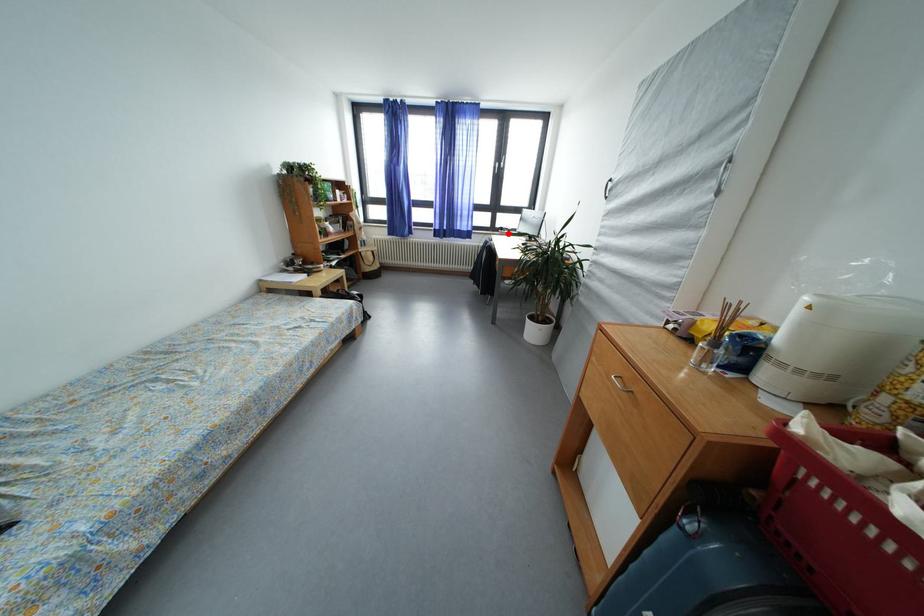
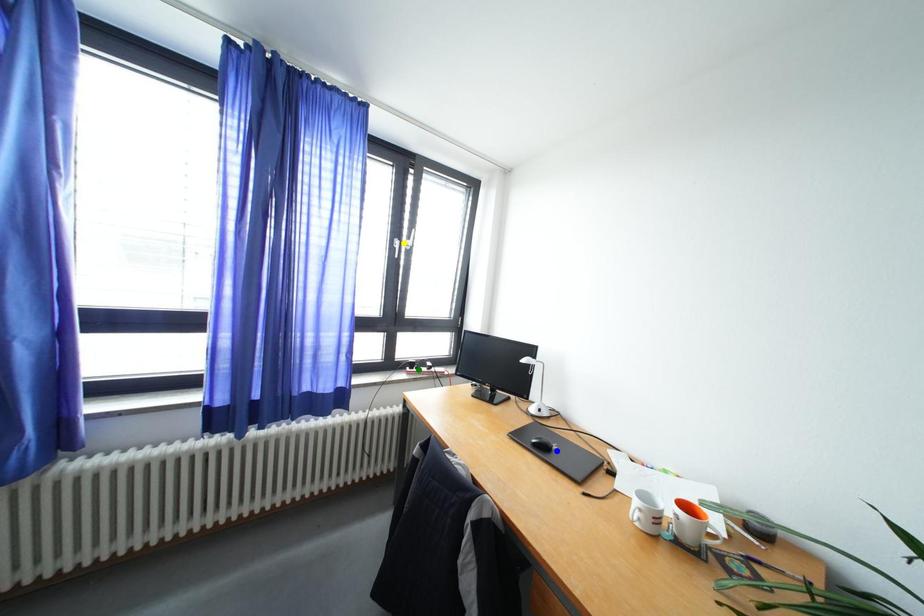
Question: I am providing you with two images of the same scene from different viewpoints. A red point is marked on the first image. You are given multiple points on the second image. Which mark in image 2 goes with the point in image 1?

Choices:
 (A) yellow point
 (B) green point
 (C) blue point

Answer: (B)